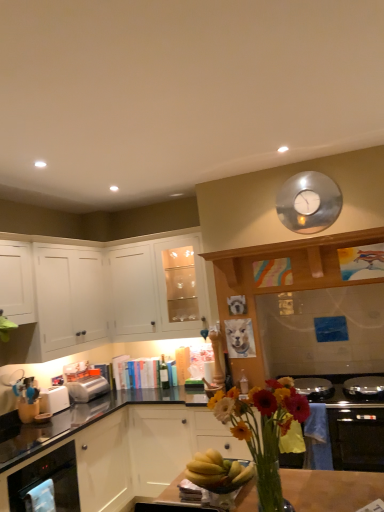
Locate an element on the screen. vacant area situated below silver metallic clock at upper center (from a real-world perspective) is located at coordinates (312, 239).